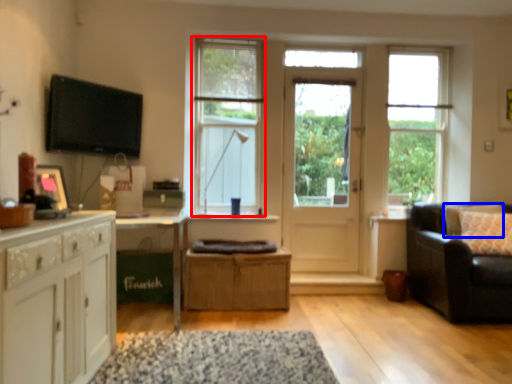
Question: Which object appears closest to the camera in this image, window (highlighted by a red box) or pillow (highlighted by a blue box)?

Choices:
 (A) window
 (B) pillow

Answer: (B)